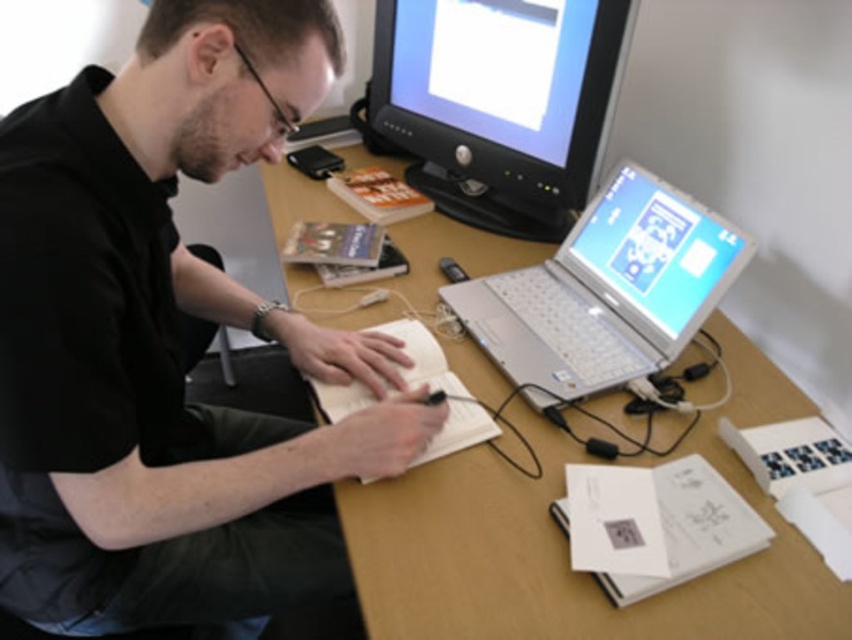
Is matte black monitor at upper center wider than silver metallic laptop at center?

Correct, the width of matte black monitor at upper center exceeds that of silver metallic laptop at center.

Does matte black monitor at upper center have a lesser width compared to silver metallic laptop at center?

Incorrect, matte black monitor at upper center's width is not less than silver metallic laptop at center's.

Where is `matte black monitor at upper center`? matte black monitor at upper center is located at coordinates (494, 104).

Image resolution: width=852 pixels, height=640 pixels. I want to click on matte black monitor at upper center, so click(x=494, y=104).

Can you confirm if black matte shirt at upper left is thinner than matte black monitor at upper center?

Incorrect, black matte shirt at upper left's width is not less than matte black monitor at upper center's.

Does black matte shirt at upper left come in front of matte black monitor at upper center?

Yes, it is.

What do you see at coordinates (167, 342) in the screenshot? This screenshot has width=852, height=640. I see `black matte shirt at upper left` at bounding box center [167, 342].

Locate an element on the screen. Image resolution: width=852 pixels, height=640 pixels. black matte shirt at upper left is located at coordinates (167, 342).

Describe the element at coordinates (565, 544) in the screenshot. Image resolution: width=852 pixels, height=640 pixels. I see `wooden at center` at that location.

Does wooden at center come behind matte black monitor at upper center?

No, it is not.

Locate an element on the screen. The width and height of the screenshot is (852, 640). wooden at center is located at coordinates (565, 544).